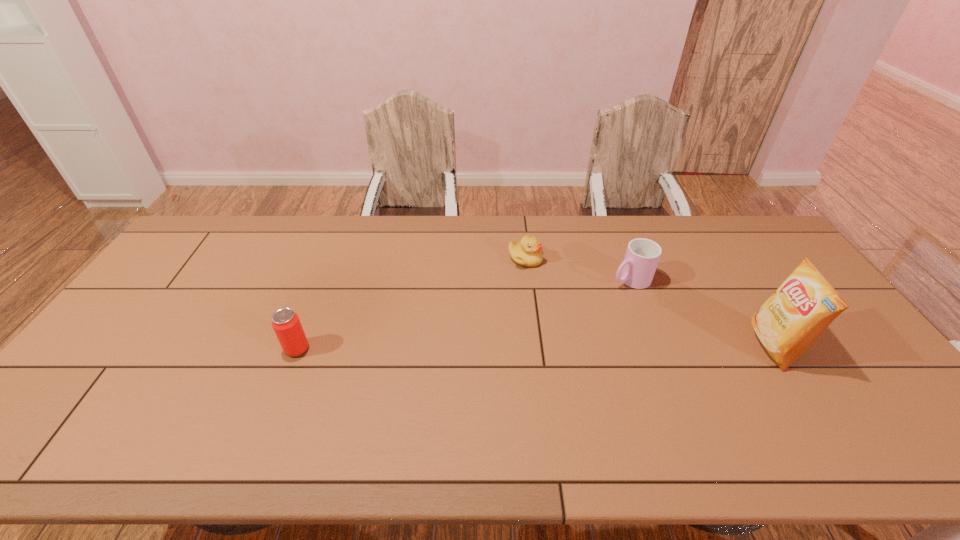
This screenshot has width=960, height=540. In order to click on beer can in this screenshot , I will do `click(286, 324)`.

Locate an element on the screen. The width and height of the screenshot is (960, 540). the rightmost object is located at coordinates (797, 313).

The width and height of the screenshot is (960, 540). Find the location of `crisp (potato chip)`. crisp (potato chip) is located at coordinates (797, 313).

The image size is (960, 540). Identify the location of the shortest object. (528, 252).

Image resolution: width=960 pixels, height=540 pixels. I want to click on the second object from left to right, so [528, 252].

Find the location of a particular element. The width and height of the screenshot is (960, 540). the second object from right to left is located at coordinates (637, 270).

This screenshot has width=960, height=540. I want to click on free space located 0.120m on the back of the leftmost object, so click(x=313, y=308).

Find the location of a particular element. This screenshot has height=540, width=960. vacant space located on the front-facing side of the tallest object is located at coordinates (676, 346).

Locate an element on the screen. vacant area located on the front-facing side of the tallest object is located at coordinates (639, 346).

Where is `vacant region located 0.350m on the front-facing side of the tallest object`? The height and width of the screenshot is (540, 960). vacant region located 0.350m on the front-facing side of the tallest object is located at coordinates (625, 346).